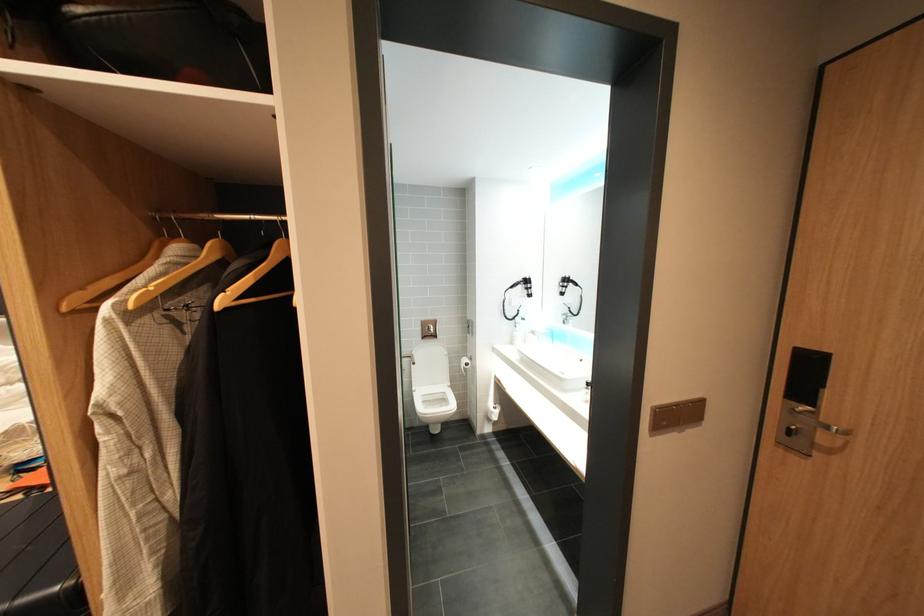
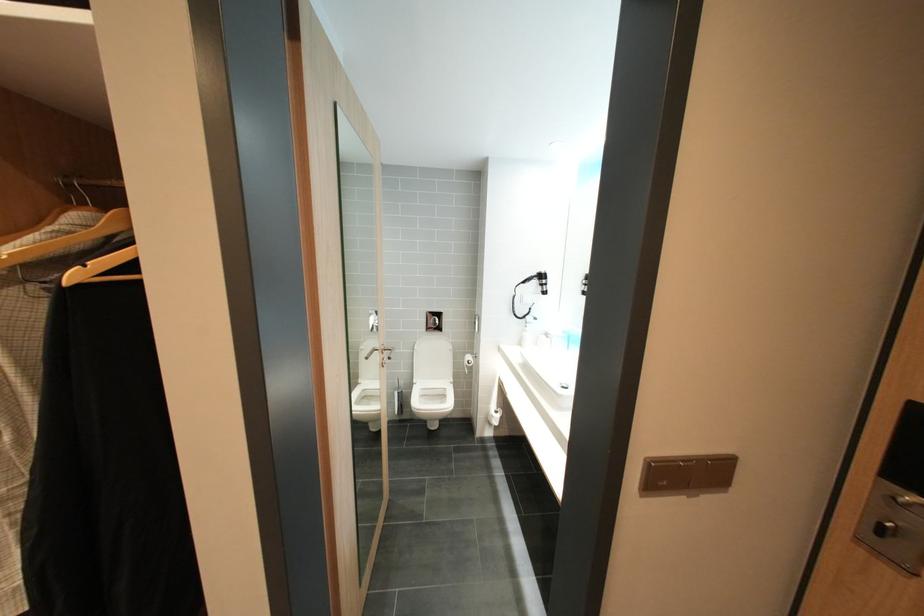
Question: I am providing you with two images of the same scene from different viewpoints. Which of the following objects are not visible in image2?

Choices:
 (A) silver door handle
 (B) wooden clothes hanger
 (C) brown light switch
 (D) none of these

Answer: (D)